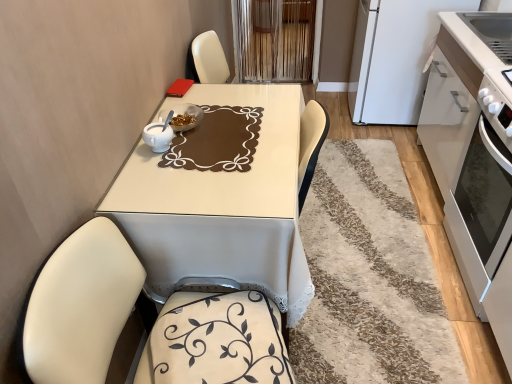
Locate an element on the screen. The height and width of the screenshot is (384, 512). free point to the right of white glossy bowl at center is located at coordinates tap(225, 125).